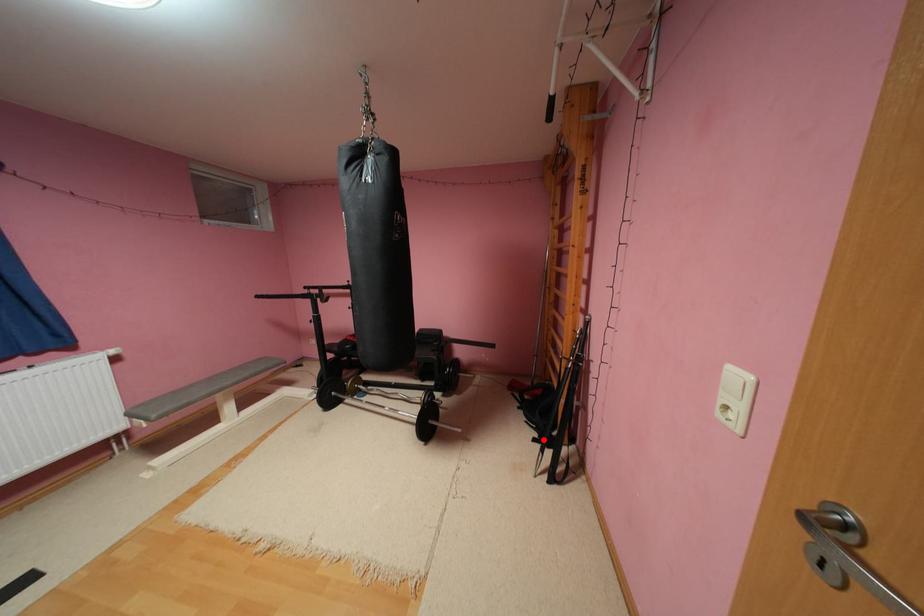
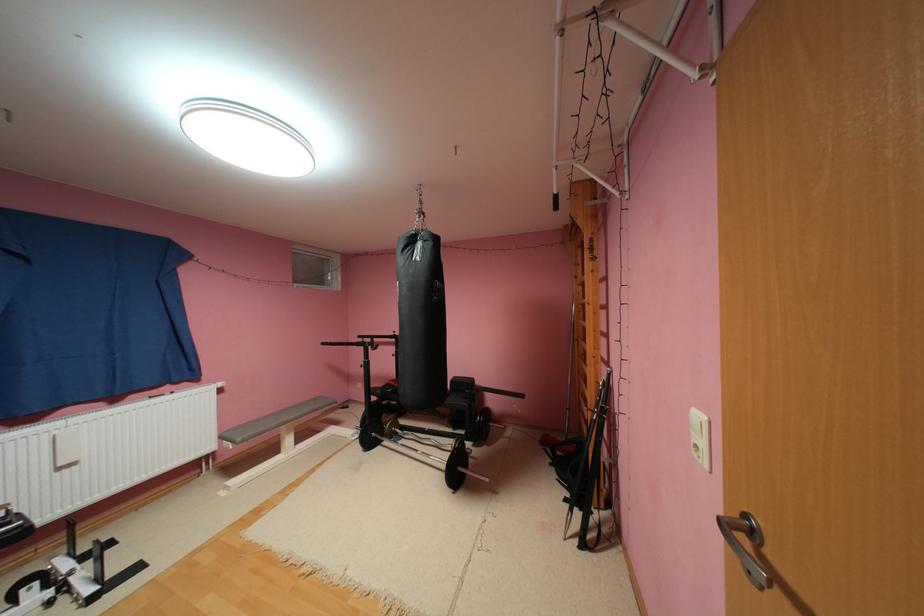
Locate, in the second image, the point that corresponds to the highlighted location in the first image.

(575, 500)